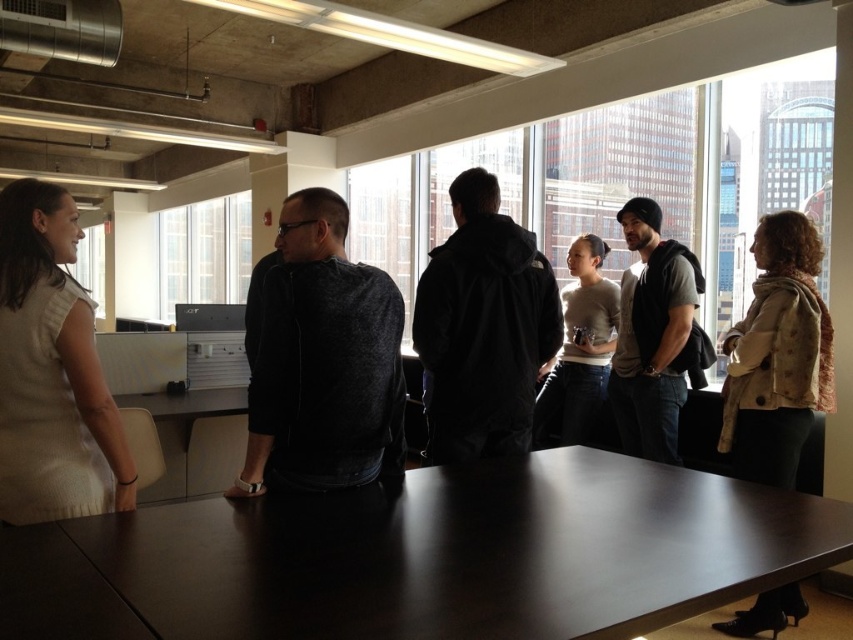
Identify the location of dark gray sweater at center. (323, 362).

What do you see at coordinates (323, 362) in the screenshot?
I see `dark gray sweater at center` at bounding box center [323, 362].

Who is more distant from viewer, (280, 452) or (730, 460)?

Positioned behind is point (730, 460).

Identify the location of dark gray sweater at center. (323, 362).

Who is taller, beige textured coat at right or light beige sweater at center?

light beige sweater at center is taller.

Is point (813, 241) farther from camera compared to point (583, 435)?

That is False.

Find the location of a particular element. The height and width of the screenshot is (640, 853). beige textured coat at right is located at coordinates (776, 355).

Is light beige sleeveless top at left smaller than black matte jacket at center?

Actually, light beige sleeveless top at left might be larger than black matte jacket at center.

Between point (25, 209) and point (527, 301), which one is positioned behind?

The point (527, 301) is more distant.

This screenshot has width=853, height=640. Find the location of `light beige sleeveless top at left`. light beige sleeveless top at left is located at coordinates (51, 371).